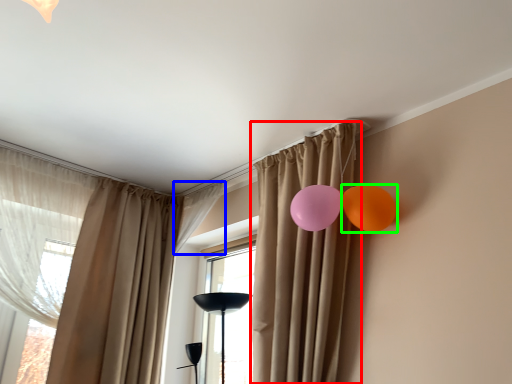
Question: Which object is the closest to the curtain (highlighted by a red box)? Choose among these: curtain (highlighted by a blue box) or balloon (highlighted by a green box).

Choices:
 (A) curtain
 (B) balloon

Answer: (B)